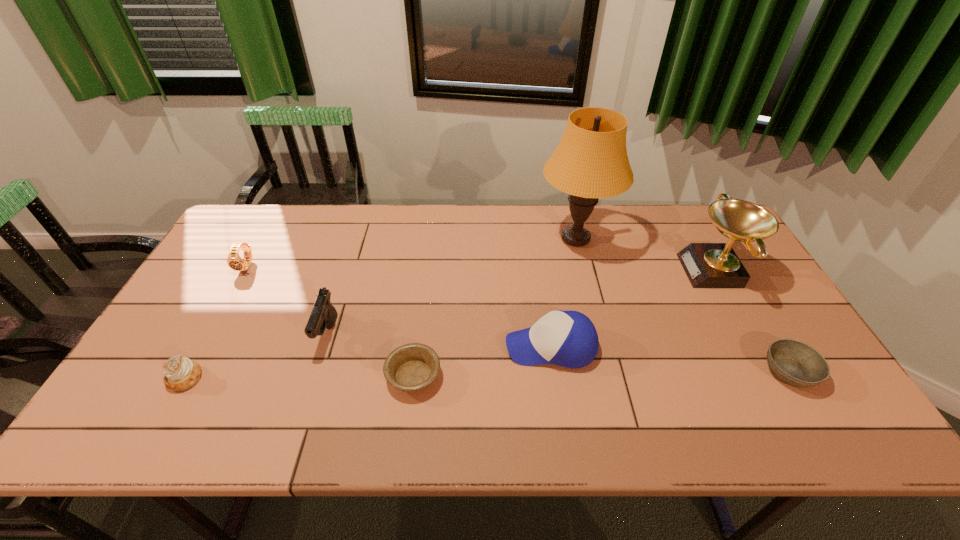
At what (x,y) coordinates should I click in order to perform the action: click on vacant space located 0.280m on the front-facing side of the award. Please return your answer as a coordinate pair (x, y). Looking at the image, I should click on (592, 271).

The image size is (960, 540). Find the location of `vacant space located 0.060m on the front-facing side of the award`. vacant space located 0.060m on the front-facing side of the award is located at coordinates (665, 271).

This screenshot has width=960, height=540. In order to click on vacant space located on the front-facing side of the award in this screenshot , I will do `click(645, 271)`.

The height and width of the screenshot is (540, 960). In order to click on vacant space located at the barrel of the pistol in this screenshot , I will do `click(294, 442)`.

Locate an element on the screen. The height and width of the screenshot is (540, 960). vacant space located on the front-facing side of the fifth shortest object is located at coordinates (467, 347).

I want to click on free space located 0.130m on the front-facing side of the fifth shortest object, so click(x=455, y=347).

This screenshot has height=540, width=960. Find the location of `vacant space located 0.300m on the front-facing side of the fifth shortest object`. vacant space located 0.300m on the front-facing side of the fifth shortest object is located at coordinates (389, 347).

Where is `free region located 0.270m on the face of the fourth shortest object`? free region located 0.270m on the face of the fourth shortest object is located at coordinates (201, 348).

Image resolution: width=960 pixels, height=540 pixels. Find the location of `blank area located 0.110m on the right of the pastry`. blank area located 0.110m on the right of the pastry is located at coordinates (247, 378).

This screenshot has width=960, height=540. Find the location of `vacant space located on the back of the right bowl`. vacant space located on the back of the right bowl is located at coordinates (753, 309).